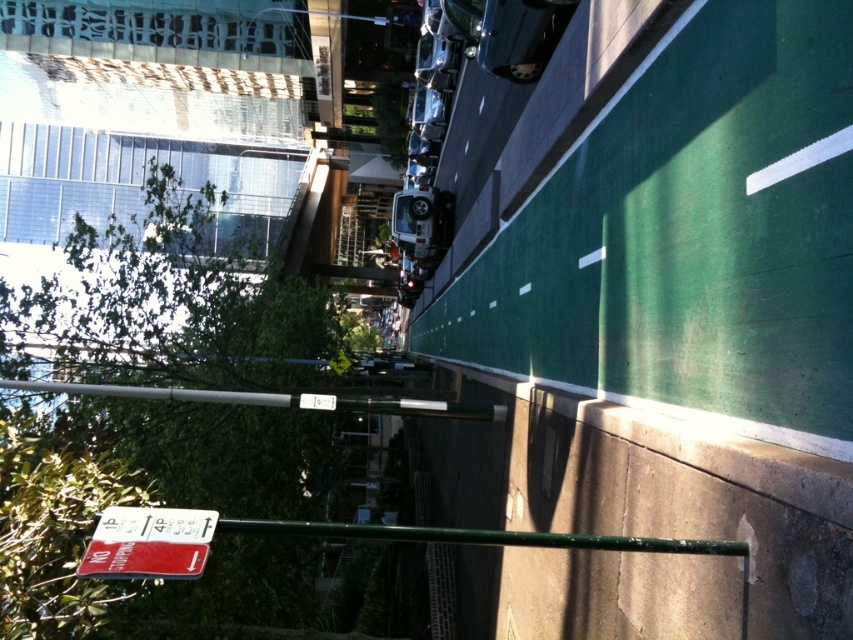
Question: Is silver metallic pole at center above metallic silver train at center?

Choices:
 (A) no
 (B) yes

Answer: (A)

Question: Where is silver metallic pole at center located in relation to metallic silver train at center in the image?

Choices:
 (A) right
 (B) left

Answer: (B)

Question: Can you confirm if silver metallic pole at center is bigger than metallic silver train at center?

Choices:
 (A) no
 (B) yes

Answer: (A)